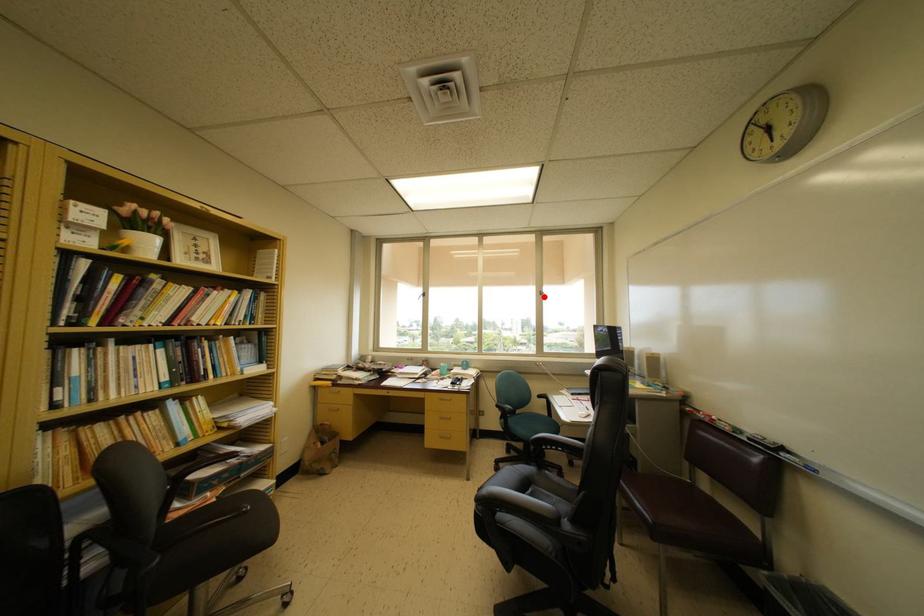
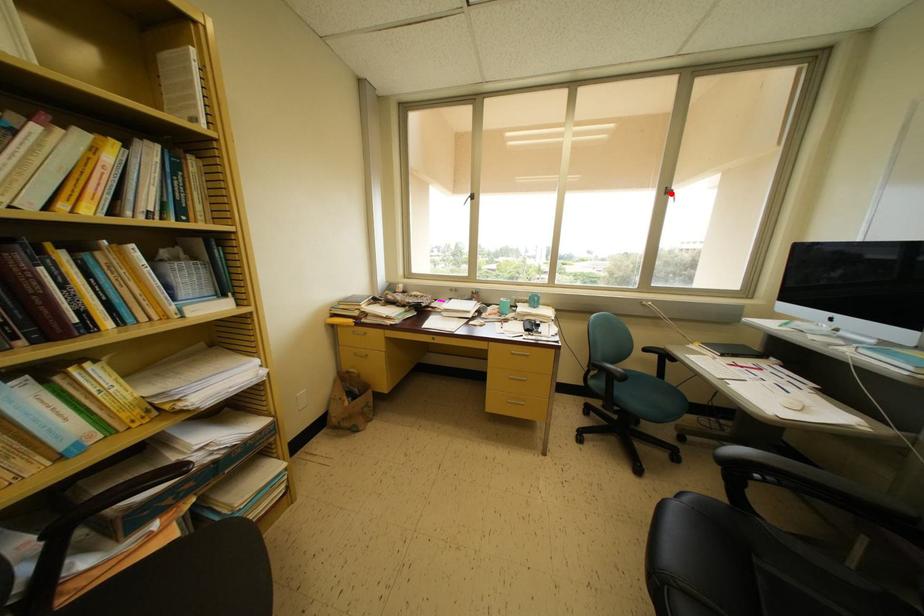
I am providing you with two images of the same scene from different viewpoints. A red point is marked on the first image and another point is marked on the second image. Is the red point in image1 aligned with the point shown in image2?

Yes